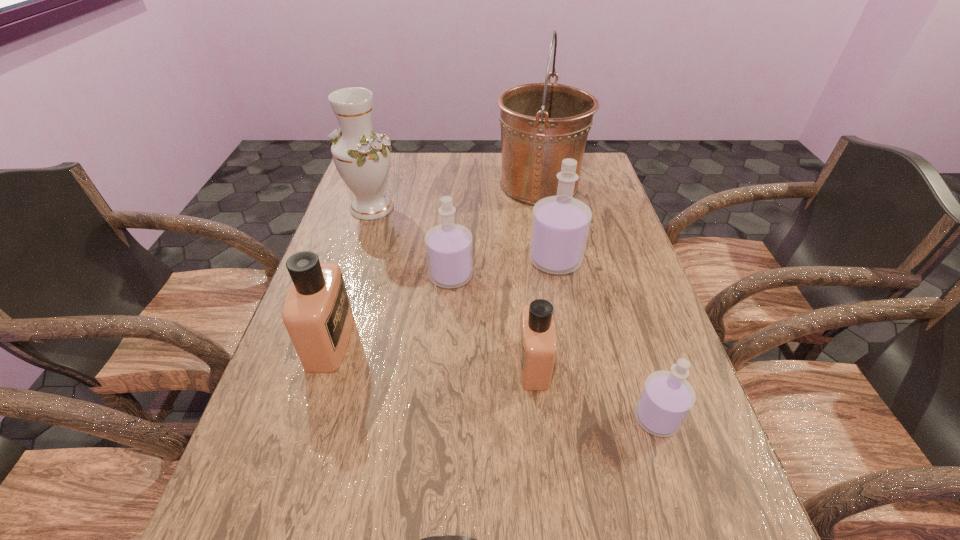
Identify the location of the smallest purple perfume. (666, 399).

This screenshot has height=540, width=960. What are the coordinates of `free location located on the left of the tallest object` in the screenshot? It's located at (450, 185).

This screenshot has width=960, height=540. In order to click on free space located on the right of the vase in this screenshot , I will do `click(480, 207)`.

I want to click on vacant area situated 0.130m on the right of the biggest purple perfume, so click(x=630, y=260).

I want to click on free space located 0.370m on the right of the second smallest purple perfume, so click(x=614, y=276).

Find the location of a particular element. vacant area situated 0.180m on the front label of the left beige perfume is located at coordinates (429, 341).

The width and height of the screenshot is (960, 540). Identify the location of vacant region located 0.120m on the front label of the smaller beige perfume. (463, 365).

The height and width of the screenshot is (540, 960). Identify the location of free space located on the front label of the smaller beige perfume. (402, 365).

At what (x,y) coordinates should I click in order to perform the action: click on free space located 0.180m on the front label of the smaller beige perfume. Please return your answer as a coordinate pair (x, y). The width and height of the screenshot is (960, 540). Looking at the image, I should click on (435, 365).

Identify the location of vacant space located 0.270m on the left of the nearest purple perfume. (495, 418).